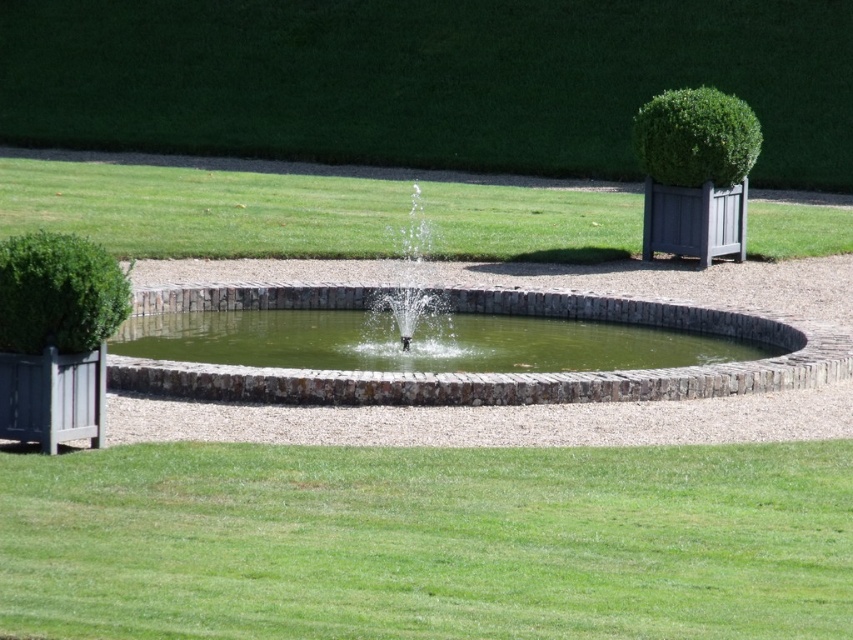
You are standing in the garden and want to touch both the green stone water at center and the clear water fountain at center. Which one would you reach first?

You would reach the green stone water at center first because it is closer to you than the clear water fountain at center, which is further away.